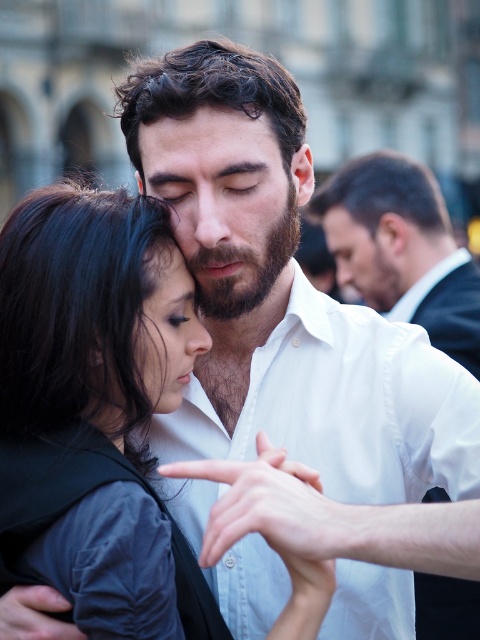
Question: From the image, what is the correct spatial relationship of white smooth shirt at center in relation to white shirt at upper right?

Choices:
 (A) right
 (B) left

Answer: (A)

Question: Which point is closer to the camera?

Choices:
 (A) white shirt at upper right
 (B) dark brown hair at center
 (C) white smooth shirt at center

Answer: (B)

Question: Which of the following is the closest to the observer?

Choices:
 (A) white smooth shirt at center
 (B) dark brown hair at center
 (C) smooth black hair at center

Answer: (C)

Question: Does smooth black hair at center appear on the left side of dark brown hair at center?

Choices:
 (A) no
 (B) yes

Answer: (B)

Question: Which of the following is the farthest from the observer?

Choices:
 (A) white shirt at upper right
 (B) white smooth shirt at center
 (C) dark brown hair at center
 (D) smooth black hair at center

Answer: (A)

Question: Can you confirm if smooth black hair at center is positioned above white shirt at upper right?

Choices:
 (A) yes
 (B) no

Answer: (B)